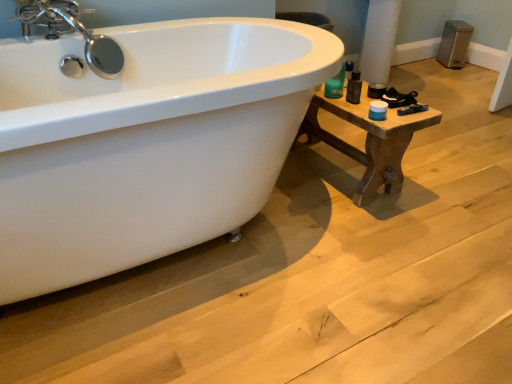
Question: Considering their positions, is chrome/metallic faucet at upper left located in front of or behind brown wooden table at right?

Choices:
 (A) front
 (B) behind

Answer: (A)

Question: In terms of height, does chrome/metallic faucet at upper left look taller or shorter compared to brown wooden table at right?

Choices:
 (A) short
 (B) tall

Answer: (A)

Question: Considering the real-world distances, which object is closest to the brown wooden table at right?

Choices:
 (A) chrome/metallic faucet at upper left
 (B) matte black container at right

Answer: (B)

Question: Estimate the real-world distances between objects in this image. Which object is farther from the matte black container at right?

Choices:
 (A) chrome/metallic faucet at upper left
 (B) brown wooden table at right

Answer: (A)